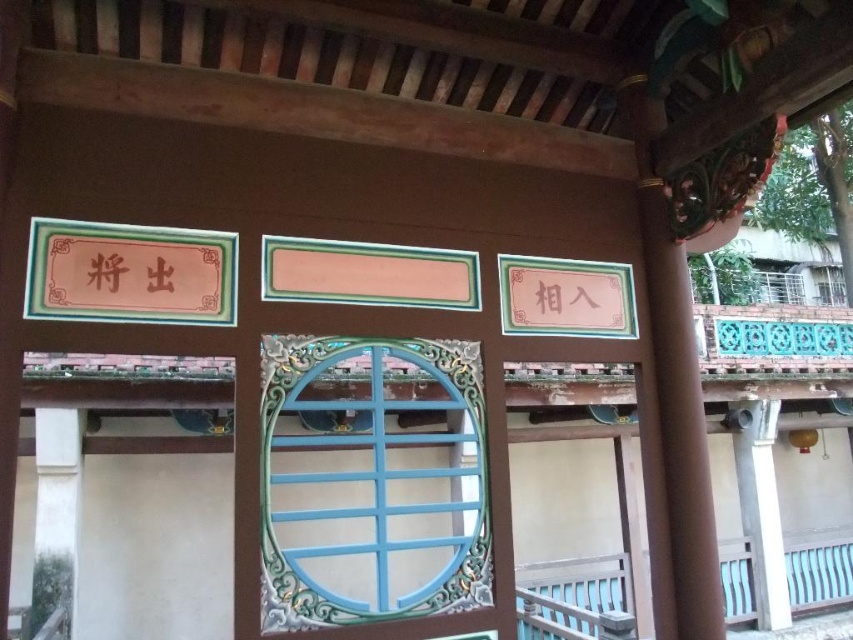
What are the coordinates of the blue painted wood window at center?

The coordinates of the blue painted wood window at center are at point (370, 481).

Based on the scene description, what is the significance of the point at coordinates (370, 481)?

The point at coordinates (370, 481) indicates the location of the blue painted wood window at center.